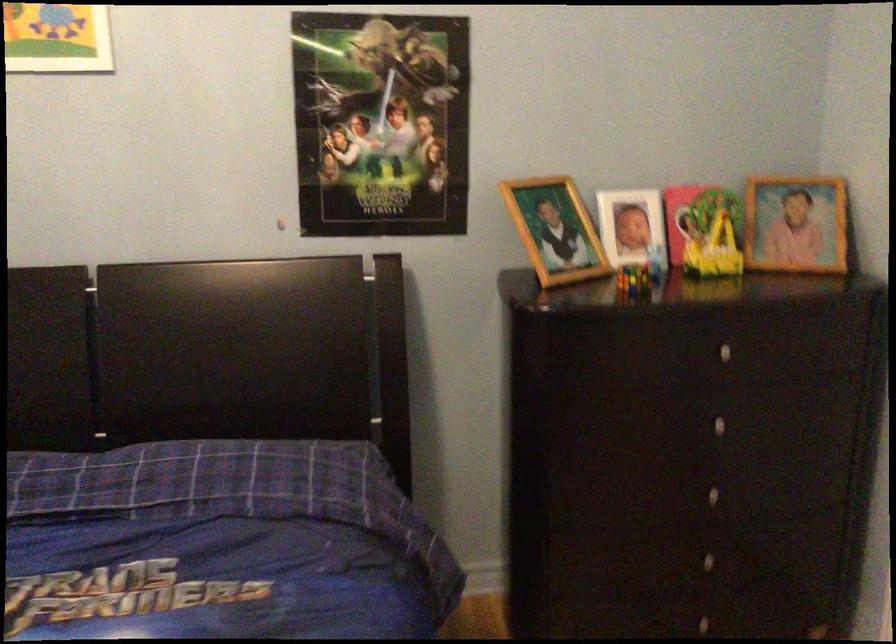
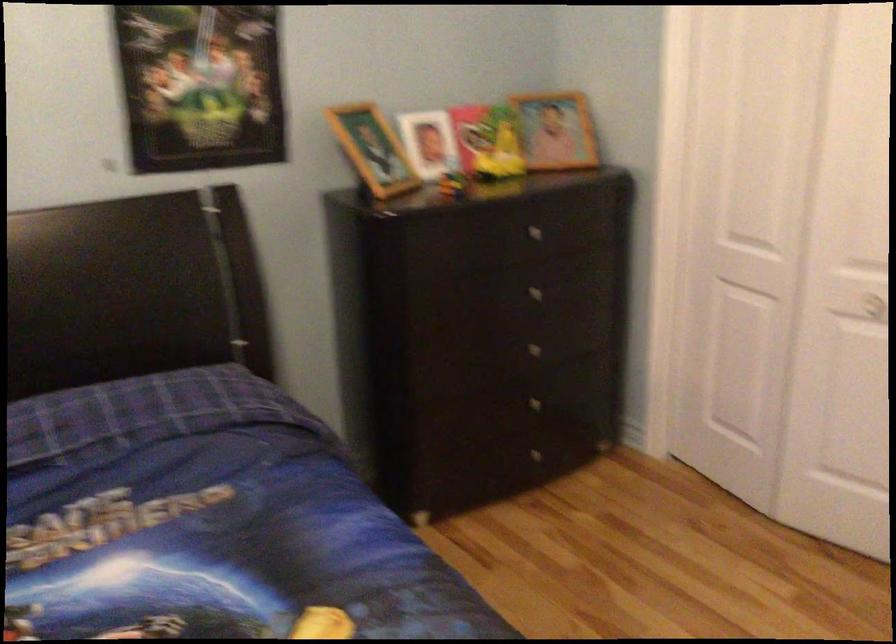
Where in the second image is the point corresponding to point 720,498 from the first image?

(539, 353)